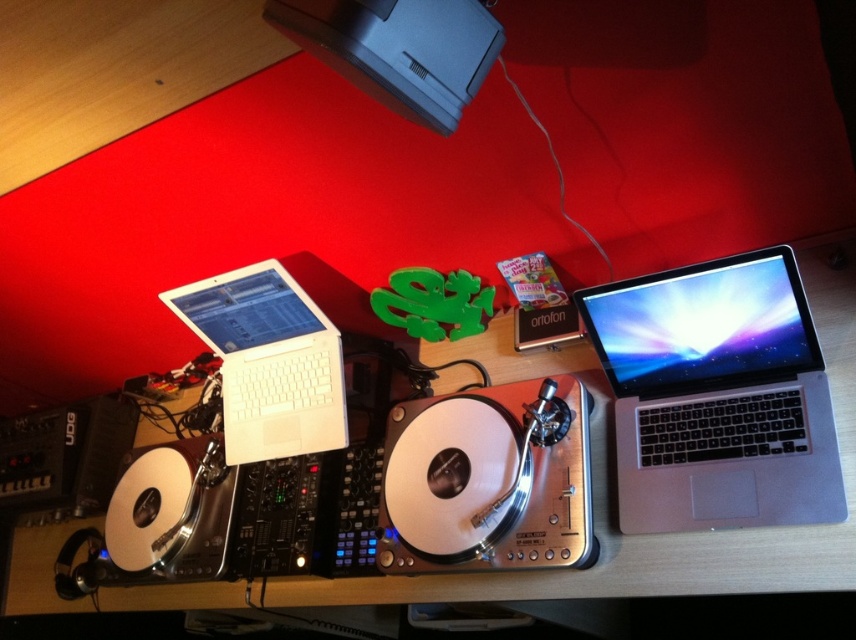
Which is below, white matte laptop at left or black plastic speaker at lower left?

black plastic speaker at lower left

Does white matte laptop at left come behind black plastic speaker at lower left?

No, it is not.

Is point (307, 445) positioned in front of point (92, 422)?

Yes, it is in front of point (92, 422).

Locate an element on the screen. This screenshot has height=640, width=856. white matte laptop at left is located at coordinates (268, 362).

Between wooden table at center and white matte laptop at left, which one is positioned lower?

wooden table at center

Identify the location of wooden table at center. (613, 492).

Does wooden table at center have a lesser height compared to black plastic speaker at lower left?

In fact, wooden table at center may be taller than black plastic speaker at lower left.

Locate an element on the screen. The height and width of the screenshot is (640, 856). wooden table at center is located at coordinates (613, 492).

What are the coordinates of `wooden table at center` in the screenshot? It's located at (613, 492).

This screenshot has width=856, height=640. In order to click on wooden table at center in this screenshot , I will do `click(613, 492)`.